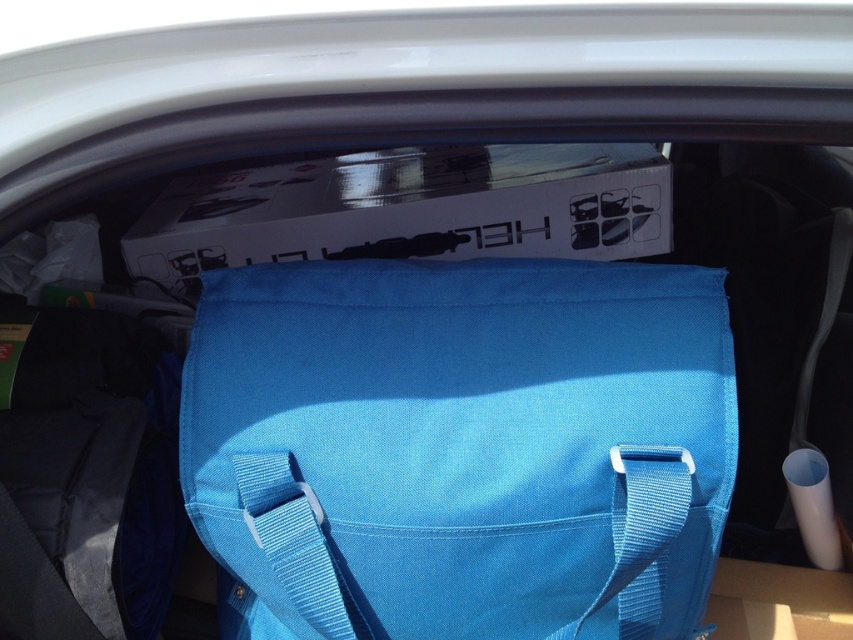
Who is positioned more to the left, blue canvas bag at center or blue fabric strap at center?

blue canvas bag at center

Can you confirm if blue canvas bag at center is thinner than blue fabric strap at center?

No, blue canvas bag at center is not thinner than blue fabric strap at center.

Is point (358, 330) more distant than point (643, 612)?

That is False.

You are a GUI agent. You are given a task and a screenshot of the screen. Output one action in this format:
    pyautogui.click(x=<x>, y=<y>)
    Task: Click on the blue canvas bag at center
    Image resolution: width=853 pixels, height=640 pixels.
    Given the screenshot: What is the action you would take?
    pyautogui.click(x=463, y=445)